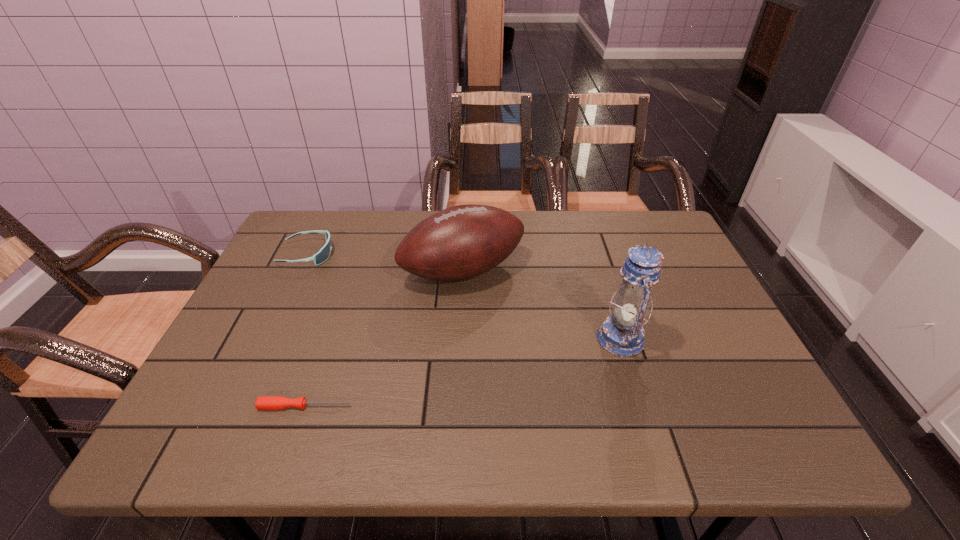
You are a GUI agent. You are given a task and a screenshot of the screen. Output one action in this format:
    pyautogui.click(x=<x>, y=<y>)
    Task: Click on the free location located on the left of the football (American)
    
    Given the screenshot: What is the action you would take?
    pyautogui.click(x=308, y=271)

Image resolution: width=960 pixels, height=540 pixels. I want to click on vacant region located on the front-facing side of the second shortest object, so click(x=350, y=254).

What are the coordinates of `free space located 0.220m at the tip of the screwdriver` in the screenshot? It's located at (459, 406).

Identify the location of football (American) at the far edge. (461, 242).

You are a GUI agent. You are given a task and a screenshot of the screen. Output one action in this format:
    pyautogui.click(x=<x>, y=<y>)
    Task: Click on the goggles that is at the far edge
    
    Given the screenshot: What is the action you would take?
    pyautogui.click(x=324, y=253)

The width and height of the screenshot is (960, 540). Find the location of `object present at the near edge`. object present at the near edge is located at coordinates (262, 402).

This screenshot has width=960, height=540. Find the location of `goggles that is positioned at the left edge`. goggles that is positioned at the left edge is located at coordinates (324, 253).

Image resolution: width=960 pixels, height=540 pixels. What are the coordinates of `screwdriver present at the left edge` in the screenshot? It's located at (262, 402).

Locate an element on the screen. This screenshot has height=540, width=960. object located in the far left corner section of the desktop is located at coordinates click(x=324, y=253).

Where is `object at the near left corner`? The width and height of the screenshot is (960, 540). object at the near left corner is located at coordinates (262, 402).